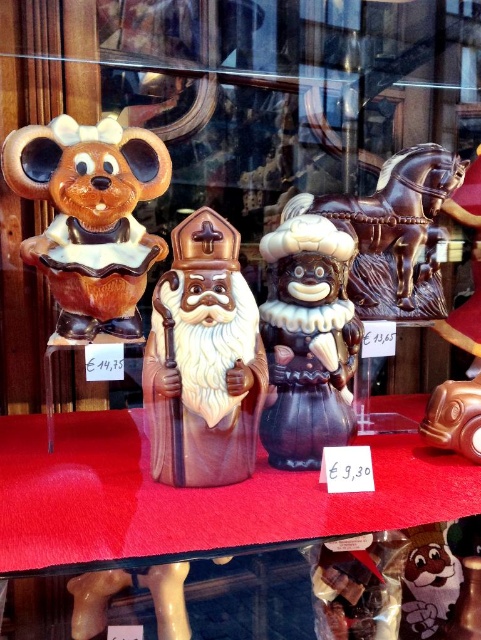
Question: Estimate the real-world distances between objects in this image. Which object is closer to the brown glossy chocolate figure at center?

Choices:
 (A) shiny chocolate figurine at center
 (B) shiny chocolate horse at center

Answer: (A)

Question: Can you confirm if shiny chocolate figurine at center is thinner than shiny chocolate horse at center?

Choices:
 (A) no
 (B) yes

Answer: (B)

Question: Among these points, which one is nearest to the camera?

Choices:
 (A) (49, 244)
 (B) (283, 298)

Answer: (B)

Question: Estimate the real-world distances between objects in this image. Which object is farther from the brown glossy chocolate figure at center?

Choices:
 (A) brown glossy mouse at left
 (B) shiny chocolate figurine at center

Answer: (A)

Question: Where is brown glossy mouse at left located in relation to shiny chocolate horse at center in the image?

Choices:
 (A) below
 (B) above

Answer: (A)

Question: Is the position of brown glossy mouse at left more distant than that of shiny chocolate horse at center?

Choices:
 (A) no
 (B) yes

Answer: (A)